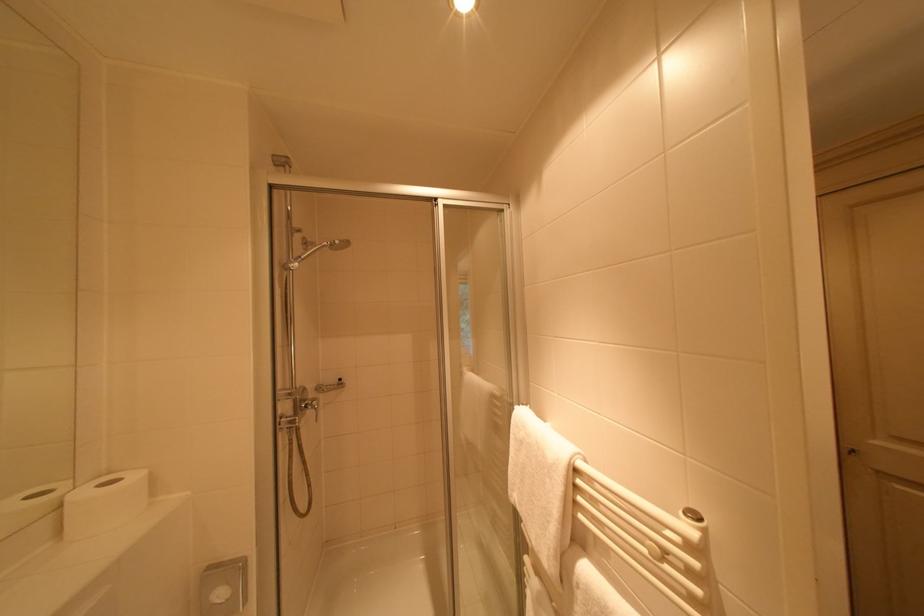
What do you see at coordinates (330, 387) in the screenshot? I see `a shower door handle` at bounding box center [330, 387].